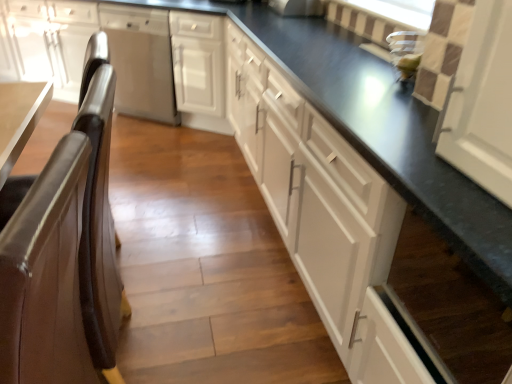
Image resolution: width=512 pixels, height=384 pixels. What do you see at coordinates (141, 61) in the screenshot?
I see `stainless steel dishwasher at center` at bounding box center [141, 61].

The height and width of the screenshot is (384, 512). What do you see at coordinates (324, 214) in the screenshot?
I see `white matte cabinet at center, marked as the 3th cabinetry in a left-to-right arrangement` at bounding box center [324, 214].

Describe the element at coordinates (76, 223) in the screenshot. The image size is (512, 384). I see `brown leather chair at left` at that location.

The image size is (512, 384). Describe the element at coordinates (199, 70) in the screenshot. I see `white matte cabinet at center, which is the 2th cabinetry in left-to-right order` at that location.

I want to click on stainless steel dishwasher at center, so click(x=141, y=61).

Is white matte cabinet at center, arranged as the second cabinetry when viewed from the right, looking in the opposite direction of brown leather chair at left?

No, white matte cabinet at center, arranged as the second cabinetry when viewed from the right, is not facing away from brown leather chair at left.

Is white matte cabinet at center, arranged as the second cabinetry when viewed from the right, not inside brown leather chair at left?

Yes.

Is white matte cabinet at center, which is the 2th cabinetry in left-to-right order, in contact with brown leather chair at left?

white matte cabinet at center, which is the 2th cabinetry in left-to-right order, and brown leather chair at left are clearly separated.

How many degrees apart are the facing directions of white matte cabinet at center, which is the 2th cabinetry in left-to-right order, and brown leather chair at left?

The facing directions of white matte cabinet at center, which is the 2th cabinetry in left-to-right order, and brown leather chair at left are 58.9 degrees apart.

Is white matte cabinet at center, the first cabinetry positioned from the right, smaller than white matte cabinet at center, arranged as the second cabinetry when viewed from the right?

Actually, white matte cabinet at center, the first cabinetry positioned from the right, might be larger than white matte cabinet at center, arranged as the second cabinetry when viewed from the right.

From the picture: Is white matte cabinet at center, marked as the 3th cabinetry in a left-to-right arrangement, closer to camera compared to white matte cabinet at center, arranged as the second cabinetry when viewed from the right?

Yes, white matte cabinet at center, marked as the 3th cabinetry in a left-to-right arrangement, is in front of white matte cabinet at center, arranged as the second cabinetry when viewed from the right.

Considering the sizes of white matte cabinet at center, the first cabinetry positioned from the right, and white matte cabinet at center, which is the 2th cabinetry in left-to-right order, in the image, is white matte cabinet at center, the first cabinetry positioned from the right, wider or thinner than white matte cabinet at center, which is the 2th cabinetry in left-to-right order,?

white matte cabinet at center, the first cabinetry positioned from the right, is thinner than white matte cabinet at center, which is the 2th cabinetry in left-to-right order.

From a real-world perspective, which is physically below, stainless steel dishwasher at center or white matte cabinet at center, the first cabinetry positioned from the right?

white matte cabinet at center, the first cabinetry positioned from the right.

Could you tell me if stainless steel dishwasher at center is facing white matte cabinet at center, marked as the 3th cabinetry in a left-to-right arrangement?

No, stainless steel dishwasher at center is not oriented towards white matte cabinet at center, marked as the 3th cabinetry in a left-to-right arrangement.

Can white matte cabinet at center, the first cabinetry positioned from the right, be found inside stainless steel dishwasher at center?

No, white matte cabinet at center, the first cabinetry positioned from the right, is not a part of stainless steel dishwasher at center.

From the image's perspective, between brown leather chair at left and satin stainless steel dishwasher at left, which is the third cabinetry from right to left, who is located below?

From the image's view, brown leather chair at left is below.

Who is bigger, brown leather chair at left or satin stainless steel dishwasher at left, marked as the 1th cabinetry in a left-to-right arrangement?

satin stainless steel dishwasher at left, marked as the 1th cabinetry in a left-to-right arrangement.

Considering the relative positions of brown leather chair at left and satin stainless steel dishwasher at left, which is the third cabinetry from right to left, in the image provided, is brown leather chair at left to the left or to the right of satin stainless steel dishwasher at left, which is the third cabinetry from right to left,?

Based on their positions, brown leather chair at left is located to the right of satin stainless steel dishwasher at left, which is the third cabinetry from right to left.

Relative to satin stainless steel dishwasher at left, marked as the 1th cabinetry in a left-to-right arrangement, is brown leather chair at left in front or behind?

In the image, brown leather chair at left appears in front of satin stainless steel dishwasher at left, marked as the 1th cabinetry in a left-to-right arrangement.

Can you see brown leather chair at left touching white matte cabinet at center, marked as the 3th cabinetry in a left-to-right arrangement?

No, brown leather chair at left is not next to white matte cabinet at center, marked as the 3th cabinetry in a left-to-right arrangement.

From a real-world perspective, between brown leather chair at left and white matte cabinet at center, the first cabinetry positioned from the right, who is vertically lower?

From a 3D spatial view, white matte cabinet at center, the first cabinetry positioned from the right, is below.

This screenshot has width=512, height=384. Find the location of `chair lying below the white matte cabinet at center, the first cabinetry positioned from the right (from the image's perspective)`. chair lying below the white matte cabinet at center, the first cabinetry positioned from the right (from the image's perspective) is located at coordinates coord(76,223).

Is brown leather chair at left positioned beyond the bounds of white matte cabinet at center, the first cabinetry positioned from the right?

→ brown leather chair at left lies outside white matte cabinet at center, the first cabinetry positioned from the right,'s area.

From a real-world perspective, is brown leather chair at left located higher than stainless steel dishwasher at center?

Yes.

Which of these two, brown leather chair at left or stainless steel dishwasher at center, stands shorter?

Standing shorter between the two is stainless steel dishwasher at center.

This screenshot has height=384, width=512. In order to click on chair below the stainless steel dishwasher at center (from the image's perspective) in this screenshot , I will do `click(76, 223)`.

Is point (99, 331) closer to camera compared to point (145, 14)?

Yes, it is.

Which of these two, satin stainless steel dishwasher at left, marked as the 1th cabinetry in a left-to-right arrangement, or white matte cabinet at center, marked as the 3th cabinetry in a left-to-right arrangement, stands taller?

With more height is satin stainless steel dishwasher at left, marked as the 1th cabinetry in a left-to-right arrangement.

From a real-world perspective, which is physically below, satin stainless steel dishwasher at left, marked as the 1th cabinetry in a left-to-right arrangement, or white matte cabinet at center, marked as the 3th cabinetry in a left-to-right arrangement?

From a 3D spatial view, white matte cabinet at center, marked as the 3th cabinetry in a left-to-right arrangement, is below.

Starting from the white matte cabinet at center, marked as the 3th cabinetry in a left-to-right arrangement, which cabinetry is the 2nd one behind? Please provide its 2D coordinates.

[(85, 48)]

From the brown leather chair at left, count 1st cabinetry to the right and point to it. Please provide its 2D coordinates.

[(199, 70)]

Image resolution: width=512 pixels, height=384 pixels. What are the coordinates of `the 2nd cabinetry above the white matte cabinet at center, marked as the 3th cabinetry in a left-to-right arrangement (from a real-world perspective)` in the screenshot? It's located at (199, 70).

Which object lies further to the anchor point stainless steel dishwasher at center, brown leather chair at left or white matte cabinet at center, marked as the 3th cabinetry in a left-to-right arrangement?

Based on the image, brown leather chair at left appears to be further to stainless steel dishwasher at center.

Estimate the real-world distances between objects in this image. Which object is further from white matte cabinet at center, arranged as the second cabinetry when viewed from the right, white matte cabinet at center, marked as the 3th cabinetry in a left-to-right arrangement, or satin stainless steel dishwasher at left, marked as the 1th cabinetry in a left-to-right arrangement?

The object further to white matte cabinet at center, arranged as the second cabinetry when viewed from the right, is white matte cabinet at center, marked as the 3th cabinetry in a left-to-right arrangement.

Considering their positions, is white matte cabinet at center, arranged as the second cabinetry when viewed from the right, positioned further to brown leather chair at left than white matte cabinet at center, the first cabinetry positioned from the right?

The object further to brown leather chair at left is white matte cabinet at center, arranged as the second cabinetry when viewed from the right.

Looking at this image, estimate the real-world distances between objects in this image. Which object is closer to satin stainless steel dishwasher at left, marked as the 1th cabinetry in a left-to-right arrangement, stainless steel dishwasher at center or white matte cabinet at center, the first cabinetry positioned from the right?

stainless steel dishwasher at center.

In the scene shown: Looking at the image, which one is located further to satin stainless steel dishwasher at left, marked as the 1th cabinetry in a left-to-right arrangement, white matte cabinet at center, which is the 2th cabinetry in left-to-right order, or white matte cabinet at center, the first cabinetry positioned from the right?

white matte cabinet at center, the first cabinetry positioned from the right, is positioned further to the anchor satin stainless steel dishwasher at left, marked as the 1th cabinetry in a left-to-right arrangement.

Estimate the real-world distances between objects in this image. Which object is further from white matte cabinet at center, arranged as the second cabinetry when viewed from the right, satin stainless steel dishwasher at left, marked as the 1th cabinetry in a left-to-right arrangement, or brown leather chair at left?

brown leather chair at left.

Estimate the real-world distances between objects in this image. Which object is further from brown leather chair at left, stainless steel dishwasher at center or satin stainless steel dishwasher at left, which is the third cabinetry from right to left?

Among the two, satin stainless steel dishwasher at left, which is the third cabinetry from right to left, is located further to brown leather chair at left.

When comparing their distances from white matte cabinet at center, which is the 2th cabinetry in left-to-right order, does brown leather chair at left or white matte cabinet at center, marked as the 3th cabinetry in a left-to-right arrangement, seem closer?

white matte cabinet at center, marked as the 3th cabinetry in a left-to-right arrangement, is closer to white matte cabinet at center, which is the 2th cabinetry in left-to-right order.

Locate an element on the screen. This screenshot has height=384, width=512. cabinetry positioned between white matte cabinet at center, the first cabinetry positioned from the right, and satin stainless steel dishwasher at left, which is the third cabinetry from right to left, from near to far is located at coordinates (199, 70).

Locate an element on the screen. Image resolution: width=512 pixels, height=384 pixels. chair positioned between white matte cabinet at center, marked as the 3th cabinetry in a left-to-right arrangement, and satin stainless steel dishwasher at left, which is the third cabinetry from right to left, from near to far is located at coordinates (76, 223).

Find the location of a particular element. cabinetry between brown leather chair at left and stainless steel dishwasher at center in the front-back direction is located at coordinates (199, 70).

Where is `chair between white matte cabinet at center, marked as the 3th cabinetry in a left-to-right arrangement, and white matte cabinet at center, arranged as the second cabinetry when viewed from the right, in the front-back direction`? Image resolution: width=512 pixels, height=384 pixels. chair between white matte cabinet at center, marked as the 3th cabinetry in a left-to-right arrangement, and white matte cabinet at center, arranged as the second cabinetry when viewed from the right, in the front-back direction is located at coordinates (76, 223).